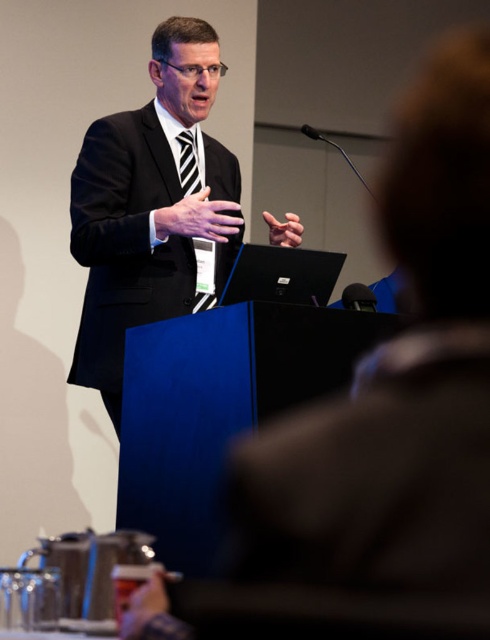
Which is below, black matte suit at center or black striped tie at center?

black matte suit at center is lower down.

Between point (169, 292) and point (181, 180), which one is positioned in front?

Point (169, 292)

Which is behind, point (217, 156) or point (186, 161)?

The point (217, 156) is behind.

Locate an element on the screen. The image size is (490, 640). black matte suit at center is located at coordinates (150, 208).